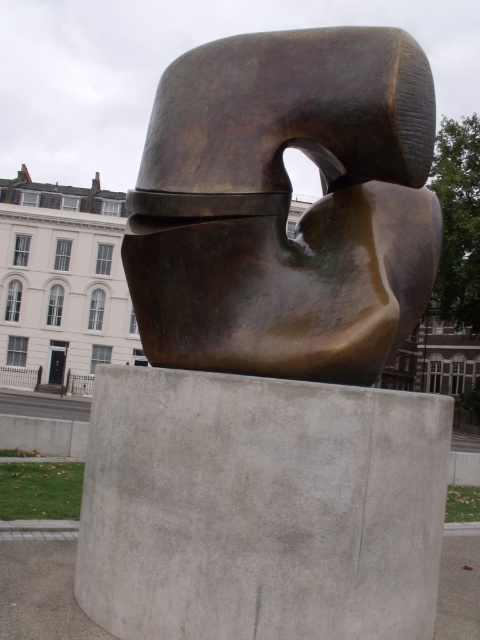
Question: Which point is closer to the camera?

Choices:
 (A) gray concrete at center
 (B) bronze sculpture at center

Answer: (A)

Question: Which object appears farthest from the camera in this image?

Choices:
 (A) gray concrete at center
 (B) bronze sculpture at center

Answer: (B)

Question: Does bronze sculpture at center have a greater width compared to gray concrete at center?

Choices:
 (A) yes
 (B) no

Answer: (B)

Question: Considering the relative positions of bronze sculpture at center and gray concrete at center in the image provided, where is bronze sculpture at center located with respect to gray concrete at center?

Choices:
 (A) above
 (B) below

Answer: (A)

Question: Does bronze sculpture at center have a greater width compared to gray concrete at center?

Choices:
 (A) yes
 (B) no

Answer: (B)

Question: Which point is farther to the camera?

Choices:
 (A) (369, 51)
 (B) (368, 536)

Answer: (A)